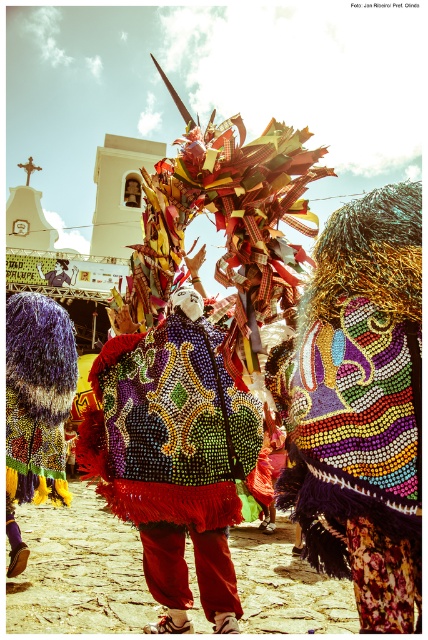
Question: Which object is farther from the camera taking this photo?

Choices:
 (A) shiny sequined vest at center
 (B) shiny sequined mask at center

Answer: (A)

Question: Is shiny sequined vest at center further to the viewer compared to shiny sequined mask at center?

Choices:
 (A) yes
 (B) no

Answer: (A)

Question: Is shiny sequined vest at center thinner than shiny sequined mask at center?

Choices:
 (A) no
 (B) yes

Answer: (A)

Question: Is shiny sequined vest at center below shiny sequined mask at center?

Choices:
 (A) yes
 (B) no

Answer: (A)